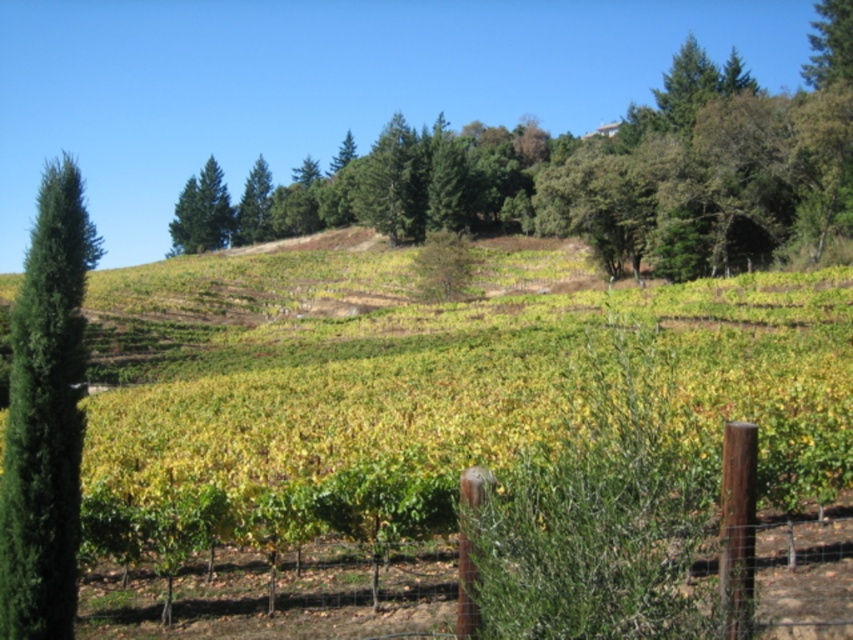
Question: In this image, where is green leafy hillside at center located relative to green textured tree at left?

Choices:
 (A) below
 (B) above

Answer: (A)

Question: Based on their relative distances, which object is nearer to the green leafy hillside at center?

Choices:
 (A) green textured tree at left
 (B) green leafy tree at upper center

Answer: (B)

Question: Is green leafy tree at upper center positioned at the back of brown wooden post at center?

Choices:
 (A) no
 (B) yes

Answer: (B)

Question: Which is nearer to the brown wooden post at center?

Choices:
 (A) green leafy hillside at center
 (B) green textured tree at left
 (C) green leafy tree at upper center

Answer: (B)

Question: Which of the following is the farthest from the observer?

Choices:
 (A) (781, 182)
 (B) (344, 602)
 (C) (49, 544)

Answer: (A)

Question: In this image, where is green leafy tree at upper center located relative to brown wooden post at center?

Choices:
 (A) right
 (B) left

Answer: (A)